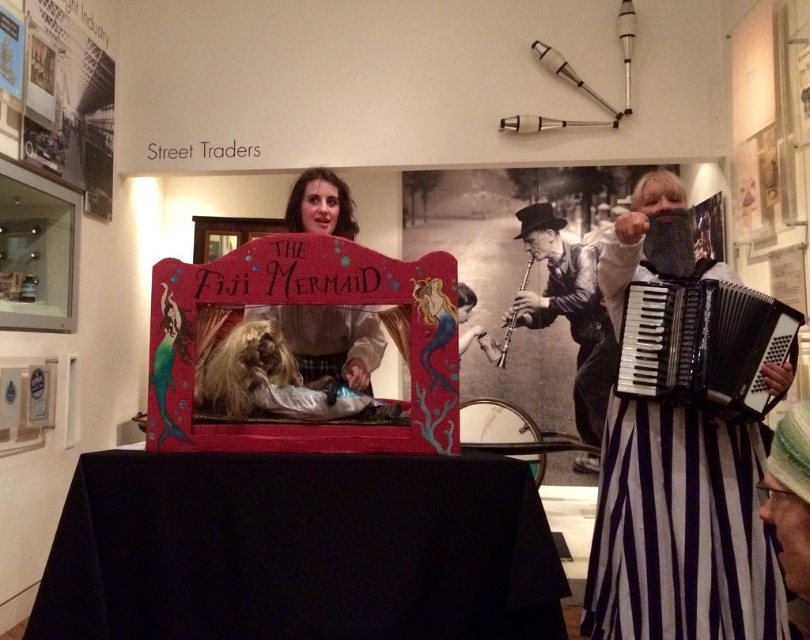
Question: Does black and white clarinet at center appear on the left side of silver metallic flute at center?

Choices:
 (A) no
 (B) yes

Answer: (A)

Question: Among these objects, which one is nearest to the camera?

Choices:
 (A) black plastic accordion at right
 (B) black fabric table at center
 (C) silver metallic flute at center
 (D) matte pink puppet at center

Answer: (B)

Question: Among these points, which one is farthest from the camera?

Choices:
 (A) (631, 225)
 (B) (501, 358)
 (C) (249, 486)
 (D) (364, 356)

Answer: (B)

Question: Is black fabric table at center smaller than matte pink puppet at center?

Choices:
 (A) yes
 (B) no

Answer: (B)

Question: Which of these objects is positioned farthest from the silver metallic flute at center?

Choices:
 (A) black striped dress at right
 (B) black and white clarinet at center
 (C) black plastic accordion at right

Answer: (C)

Question: Does black striped dress at right appear on the right side of black plastic accordion at right?

Choices:
 (A) no
 (B) yes

Answer: (A)